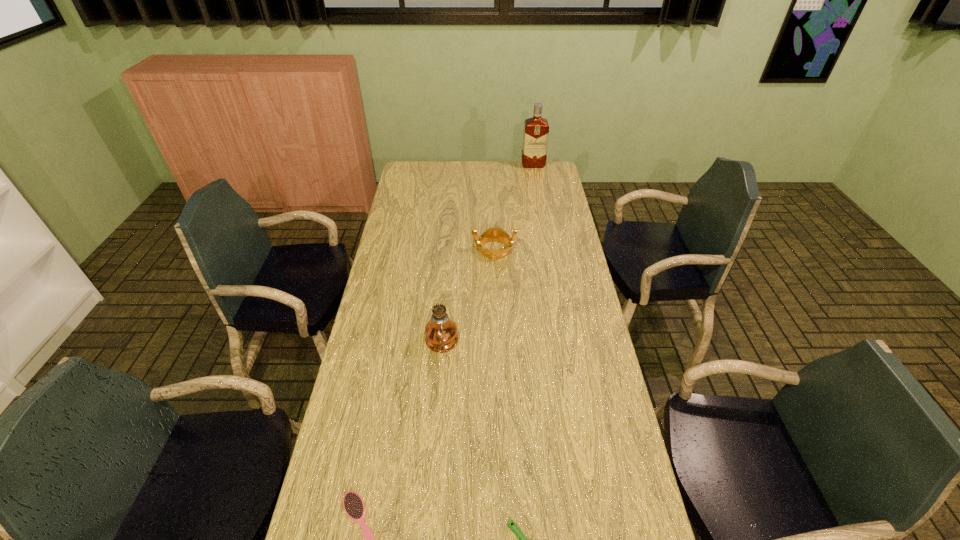
This screenshot has width=960, height=540. What are the coordinates of `the rightmost object` in the screenshot? It's located at (536, 129).

Where is `liquor`? This screenshot has height=540, width=960. liquor is located at coordinates (536, 129).

Find the location of a particular element. oil lamp is located at coordinates (441, 335).

At what (x,y) coordinates should I click in order to perform the action: click on the fourth object from right to left. Please return your answer as a coordinate pair (x, y). This screenshot has width=960, height=540. Looking at the image, I should click on (441, 335).

You are a GUI agent. You are given a task and a screenshot of the screen. Output one action in this format:
    pyautogui.click(x=<x>, y=<y>)
    Task: Click on the third shortest object
    Image resolution: width=960 pixels, height=540 pixels.
    Given the screenshot: What is the action you would take?
    (494, 233)

The width and height of the screenshot is (960, 540). I want to click on the fourth nearest object, so click(494, 233).

You are a GUI agent. You are given a task and a screenshot of the screen. Output one action in this format:
    pyautogui.click(x=<x>, y=<y>)
    Task: Click on the vacant space positioned 0.140m on the front label of the liquor
    
    Given the screenshot: What is the action you would take?
    pyautogui.click(x=537, y=183)

You are a GUI agent. You are given a task and a screenshot of the screen. Output one action in this format:
    pyautogui.click(x=<x>, y=<y>)
    Task: Click on the vacant space located on the back of the oil lamp
    The image size is (960, 540).
    Given the screenshot: What is the action you would take?
    pyautogui.click(x=445, y=299)

What are the coordinates of `free space located at the front emblem of the fourth nearest object` in the screenshot? It's located at (414, 249).

Locate an element on the screen. The width and height of the screenshot is (960, 540). free spot located 0.360m at the front emblem of the fourth nearest object is located at coordinates (385, 249).